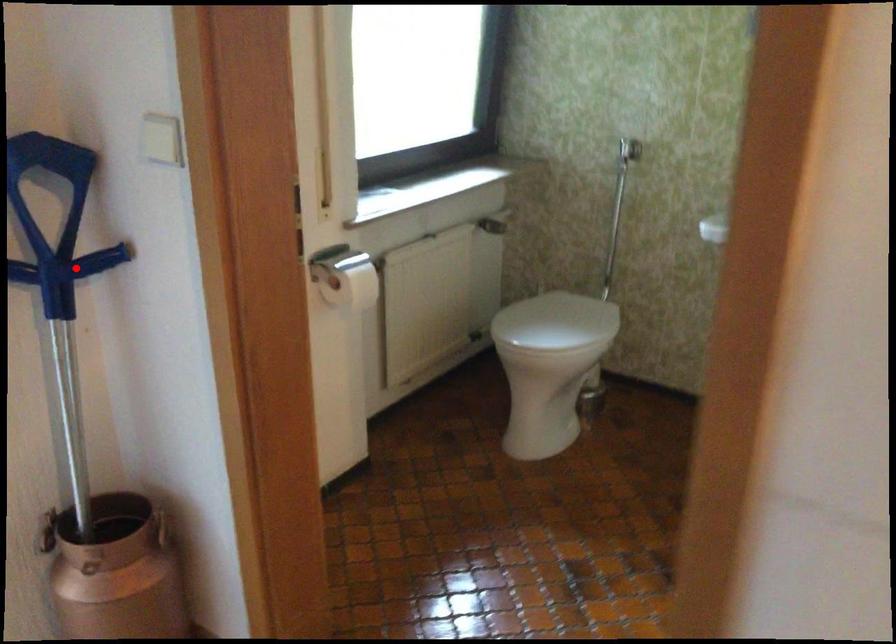
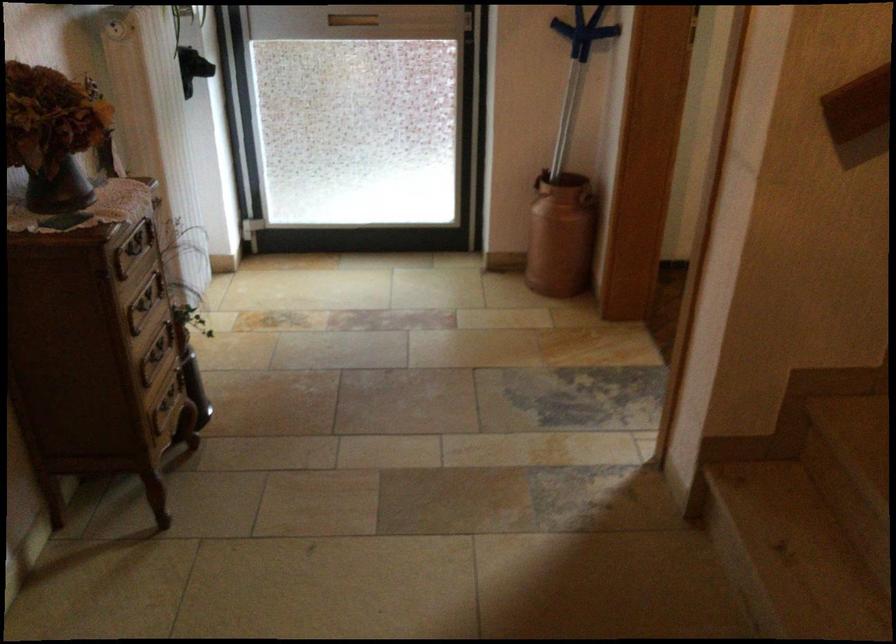
Locate, in the second image, the point that corresponds to the highlighted location in the first image.

(583, 31)